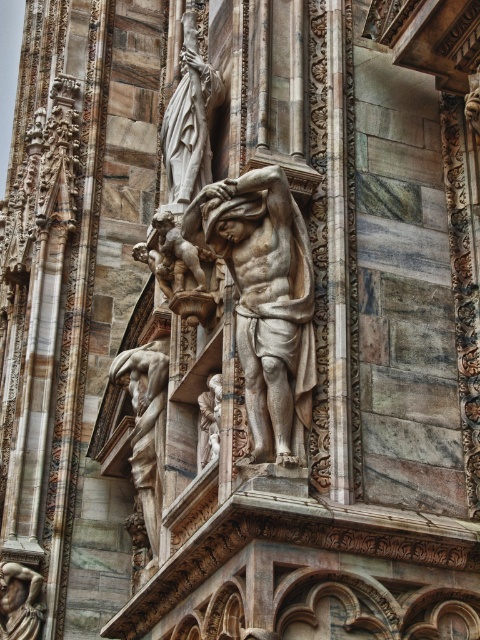
You are an architect examining the cathedral facade. You need to place a new decorative element exactly at the center of the image. Is the marble statue at center already positioned at the exact center coordinates of the image?

The marble statue at center is located at point (264, 300), which is close to but not exactly at the center coordinates of the image. Therefore, the statue is not precisely at the center.

You are an architect analyzing the structural integrity of the grand architectural structure. You need to determine the position of the marble statue at center relative to the central axis of the building. Is it positioned to the left, right, or exactly on the central axis?

The marble statue at center is located at point (264, 300), which is slightly to the right of the central axis of the building.